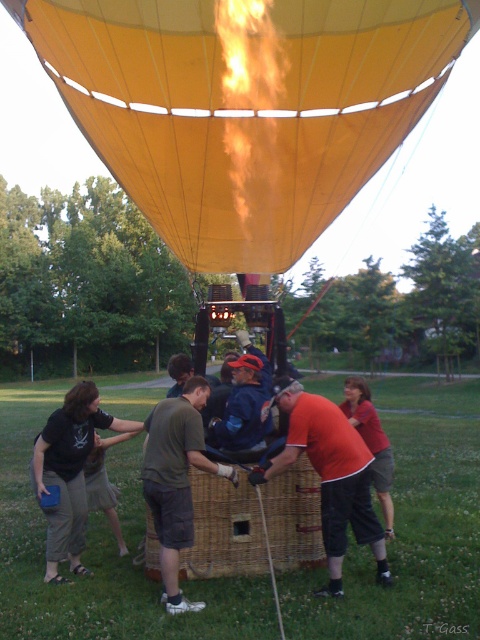
Question: From the image, what is the correct spatial relationship of yellow fabric balloon at upper center in relation to blue denim jacket at center?

Choices:
 (A) left
 (B) right

Answer: (A)

Question: Which of the following is the farthest from the observer?

Choices:
 (A) (393, 525)
 (B) (305, 157)

Answer: (A)

Question: Is yellow fabric balloon at upper center behind matte black shirt at lower left?

Choices:
 (A) no
 (B) yes

Answer: (A)

Question: Is matte black shirt at lower left to the right of matte red shirt at lower right from the viewer's perspective?

Choices:
 (A) yes
 (B) no

Answer: (B)

Question: Among these points, which one is nearest to the camera?

Choices:
 (A) (322, 150)
 (B) (208, 401)
 (C) (328, 480)

Answer: (C)

Question: Which of these objects is positioned farthest from the red-orange shirt at lower center?

Choices:
 (A) matte black shirt at lower left
 (B) dark green fabric shirt at center
 (C) blue denim jacket at center

Answer: (A)